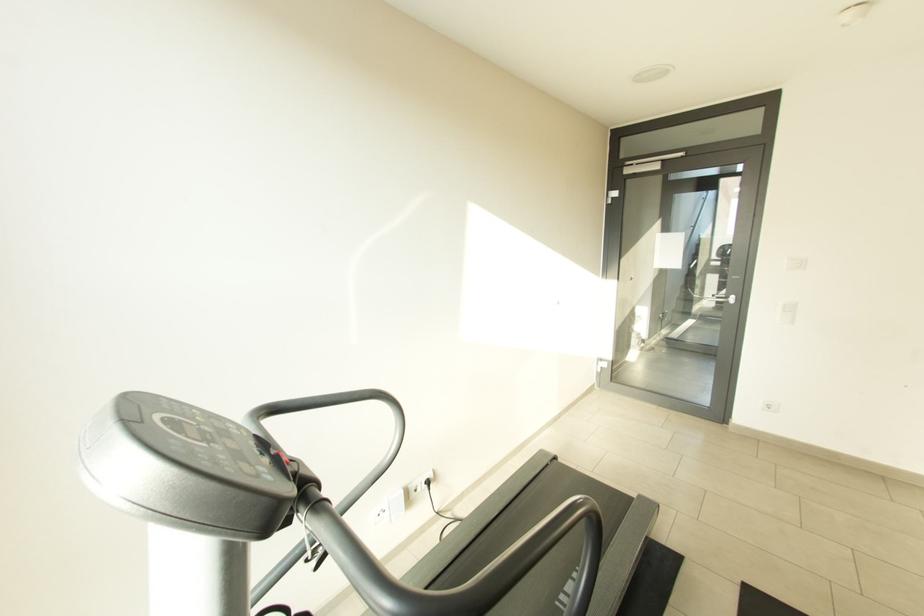
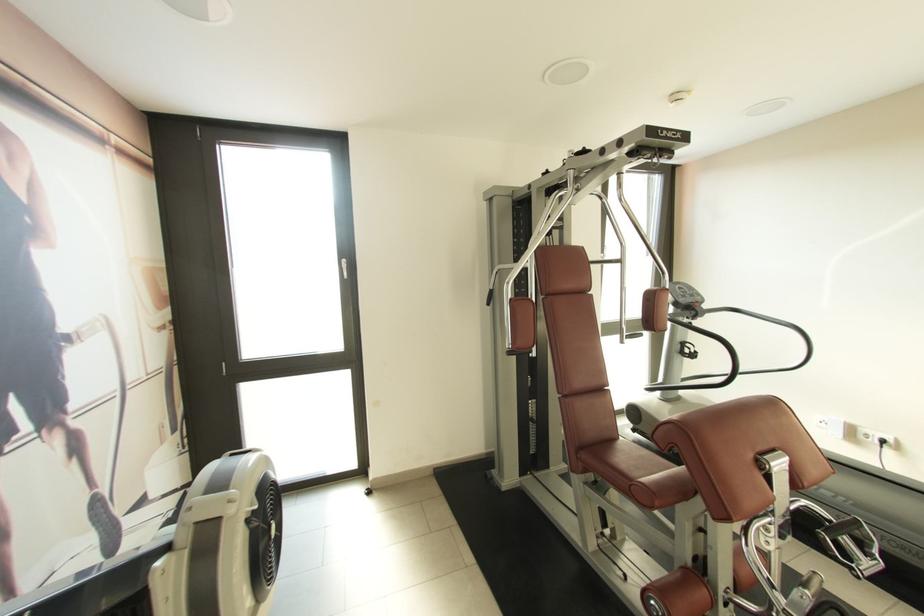
Locate, in the second image, the point that corresponds to point 431,488 in the first image.

(882, 445)